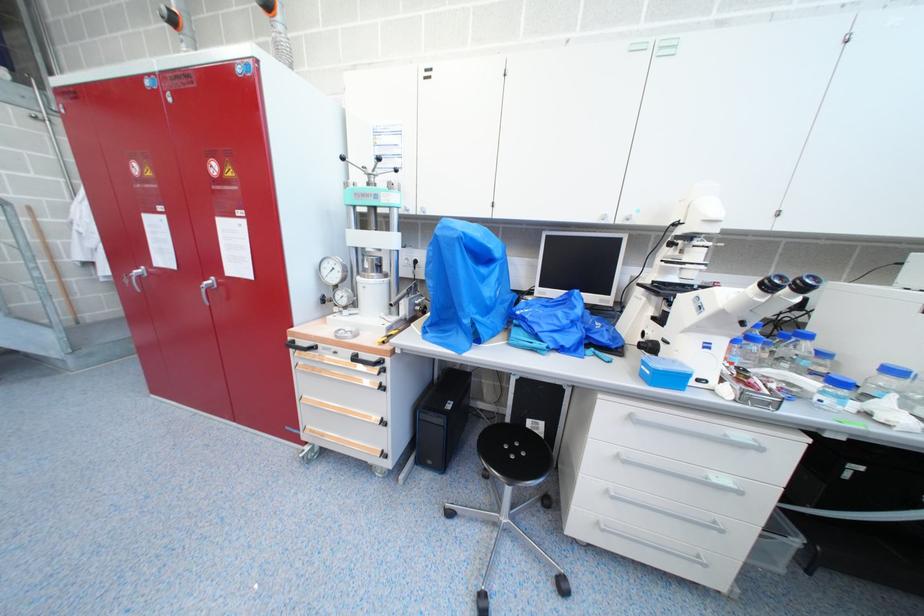
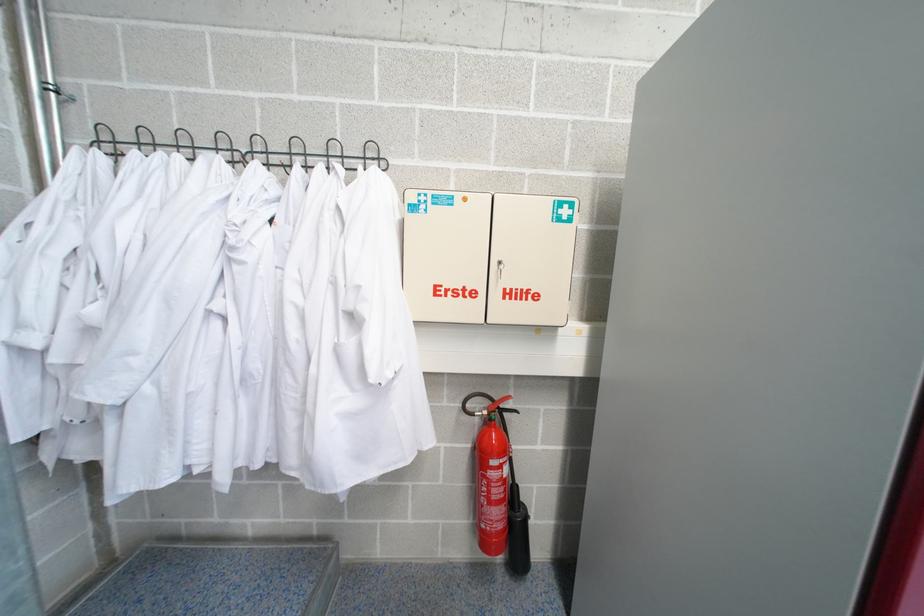
What movement of the cameraman would produce the second image?

The movement direction of the cameraman is left, forward.